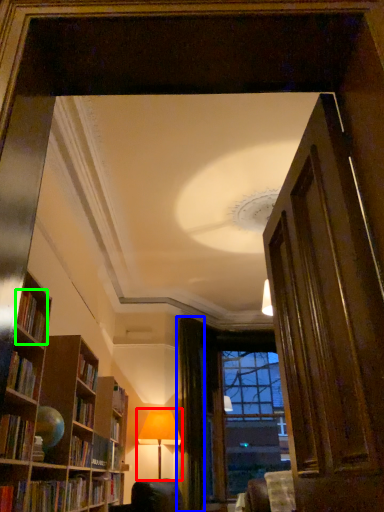
Question: Estimate the real-world distances between objects in this image. Which object is farther from table lamp (highlighted by a red box), curtain (highlighted by a blue box) or book (highlighted by a green box)?

Choices:
 (A) curtain
 (B) book

Answer: (B)